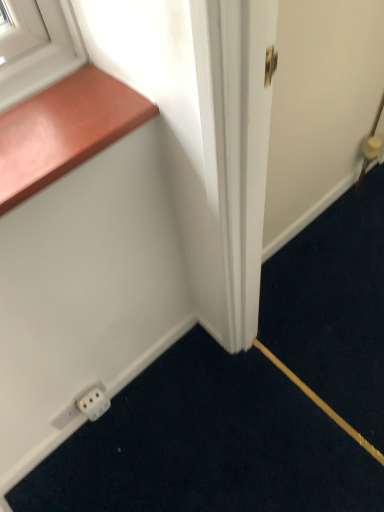
Question: From the image's perspective, would you say wooden at upper left is positioned over white plastic electric outlet at lower left, acting as the first electric outlet starting from the left?

Choices:
 (A) no
 (B) yes

Answer: (B)

Question: Is the depth of wooden at upper left greater than that of white plastic electric outlet at lower left, the second electric outlet when ordered from right to left?

Choices:
 (A) no
 (B) yes

Answer: (A)

Question: Is wooden at upper left in front of white plastic electric outlet at lower left, the second electric outlet when ordered from right to left?

Choices:
 (A) no
 (B) yes

Answer: (B)

Question: From the image's perspective, is wooden at upper left below white plastic electric outlet at lower left, the second electric outlet when ordered from right to left?

Choices:
 (A) no
 (B) yes

Answer: (A)

Question: Does wooden at upper left appear on the right side of white plastic electric outlet at lower left, acting as the first electric outlet starting from the left?

Choices:
 (A) yes
 (B) no

Answer: (A)

Question: Can you confirm if wooden at upper left is bigger than white plastic electric outlet at lower left, acting as the first electric outlet starting from the left?

Choices:
 (A) yes
 (B) no

Answer: (A)

Question: Is white plastic outlet at lower left, the first electric outlet when ordered from right to left, positioned behind wooden at upper left?

Choices:
 (A) no
 (B) yes

Answer: (B)

Question: Is wooden at upper left located within white plastic outlet at lower left, the first electric outlet when ordered from right to left?

Choices:
 (A) yes
 (B) no

Answer: (B)

Question: Are white plastic outlet at lower left, the first electric outlet when ordered from right to left, and wooden at upper left beside each other?

Choices:
 (A) yes
 (B) no

Answer: (B)

Question: Is white plastic outlet at lower left, the first electric outlet when ordered from right to left, positioned far away from wooden at upper left?

Choices:
 (A) no
 (B) yes

Answer: (A)

Question: From the image's perspective, is white plastic outlet at lower left, the second electric outlet positioned from the left, over wooden at upper left?

Choices:
 (A) no
 (B) yes

Answer: (A)

Question: From a real-world perspective, is white plastic outlet at lower left, the second electric outlet positioned from the left, over wooden at upper left?

Choices:
 (A) yes
 (B) no

Answer: (B)

Question: Does white plastic outlet at lower left, the first electric outlet when ordered from right to left, appear on the left side of white plastic electric outlet at lower left, acting as the first electric outlet starting from the left?

Choices:
 (A) no
 (B) yes

Answer: (A)